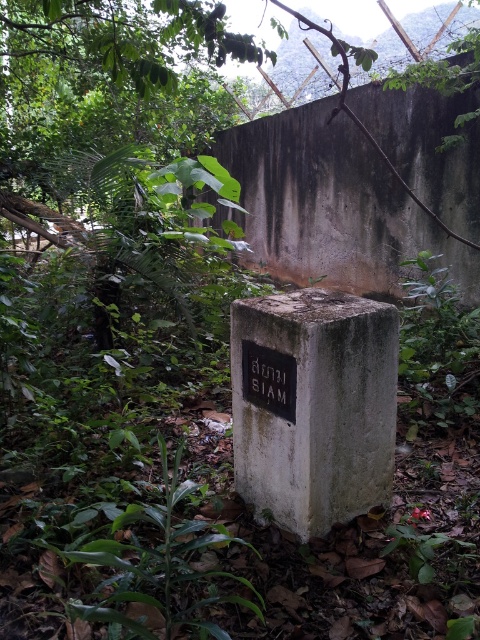
Based on the photo, between gray concrete block at center and black matte plaque at center, which one is positioned higher?

black matte plaque at center is above.

This screenshot has width=480, height=640. What do you see at coordinates (312, 404) in the screenshot?
I see `gray concrete block at center` at bounding box center [312, 404].

Where is `gray concrete block at center`? Image resolution: width=480 pixels, height=640 pixels. gray concrete block at center is located at coordinates (312, 404).

Where is `gray concrete block at center`? gray concrete block at center is located at coordinates (312, 404).